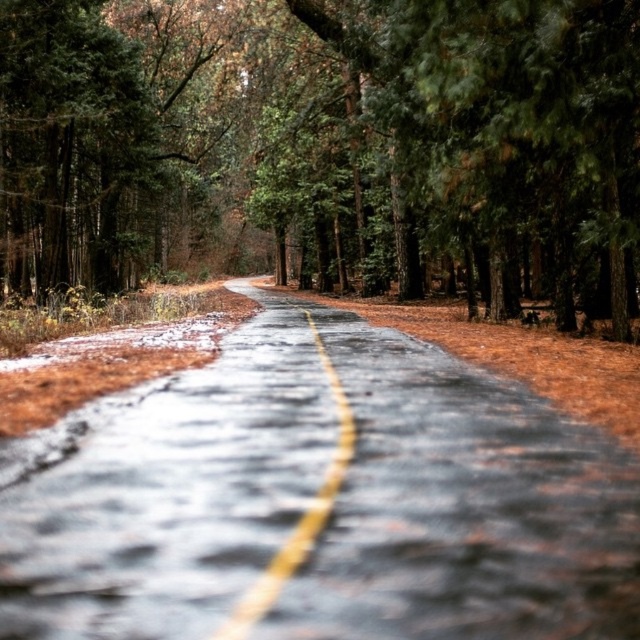
Is glossy asphalt road at center positioned before yellow matte line at center?

That is False.

Which is behind, point (392, 627) or point (227, 630)?

The point (392, 627) is behind.

Does point (8, 568) lie in front of point (336, 461)?

Yes, it is.

Find the location of a particular element. The image size is (640, 640). glossy asphalt road at center is located at coordinates (317, 499).

Describe the element at coordinates (326, 147) in the screenshot. I see `green textured tree at center` at that location.

Which is behind, point (321, 12) or point (324, 477)?

The point (321, 12) is behind.

Identify the location of green textured tree at center. (326, 147).

Can you confirm if green textured tree at center is thinner than glossy asphalt road at center?

No, green textured tree at center is not thinner than glossy asphalt road at center.

Between green textured tree at center and glossy asphalt road at center, which one is positioned higher?

green textured tree at center is higher up.

Which is in front, point (54, 266) or point (292, 576)?

Positioned in front is point (292, 576).

Where is `green textured tree at center`? The image size is (640, 640). green textured tree at center is located at coordinates (326, 147).